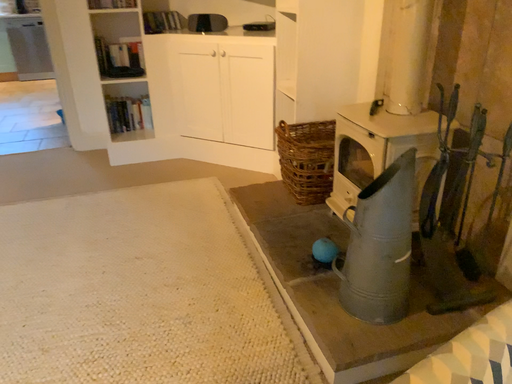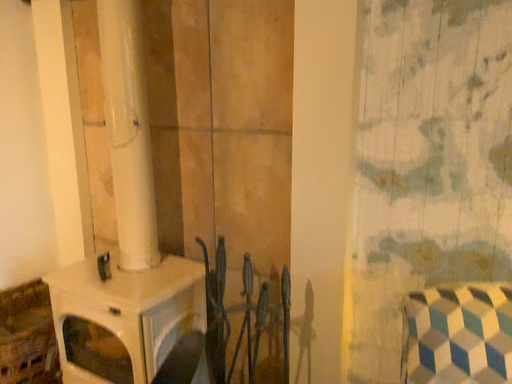
Question: How did the camera likely rotate when shooting the video?

Choices:
 (A) rotated upward
 (B) rotated downward

Answer: (A)